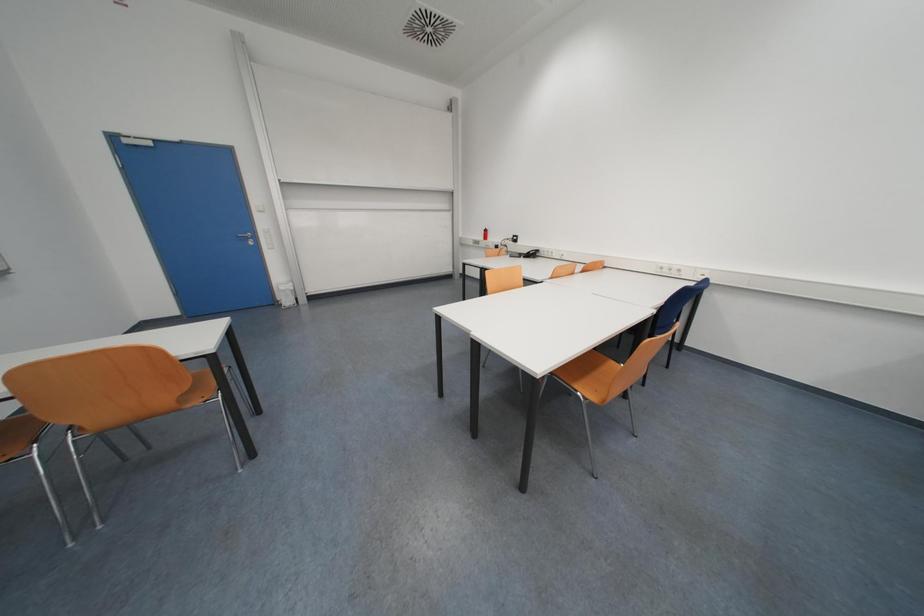
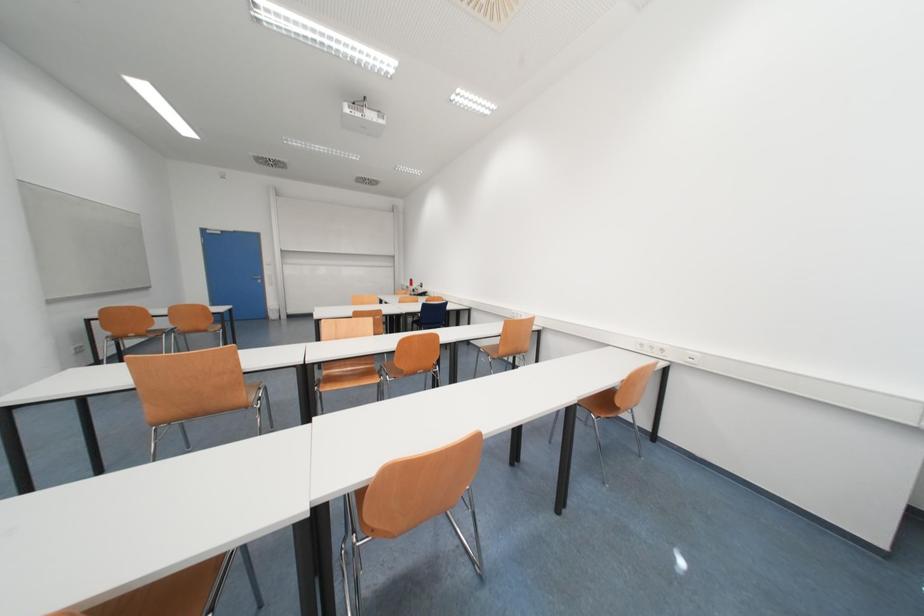
The images are taken continuously from a first-person perspective. In which direction are you moving?

The movement direction of the cameraman is right, backward.